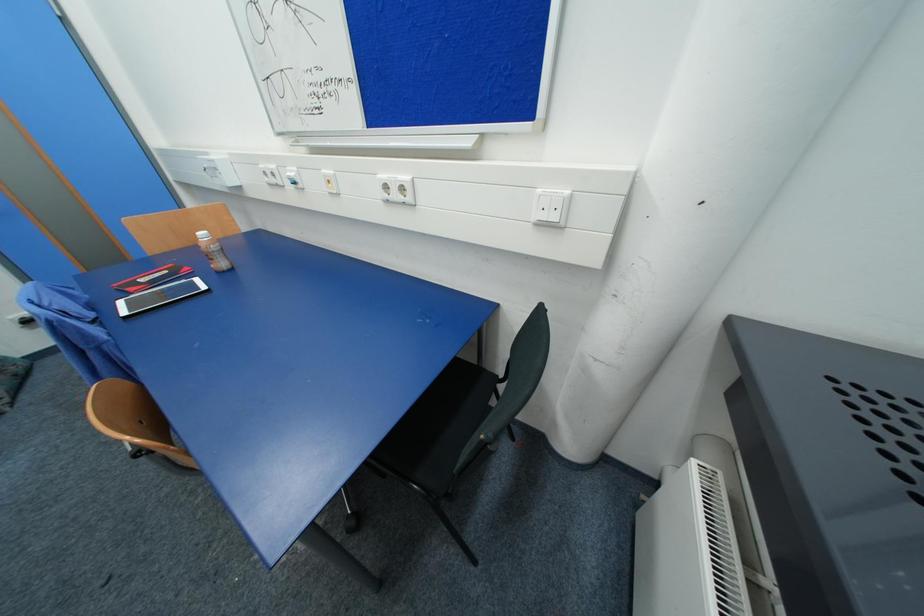
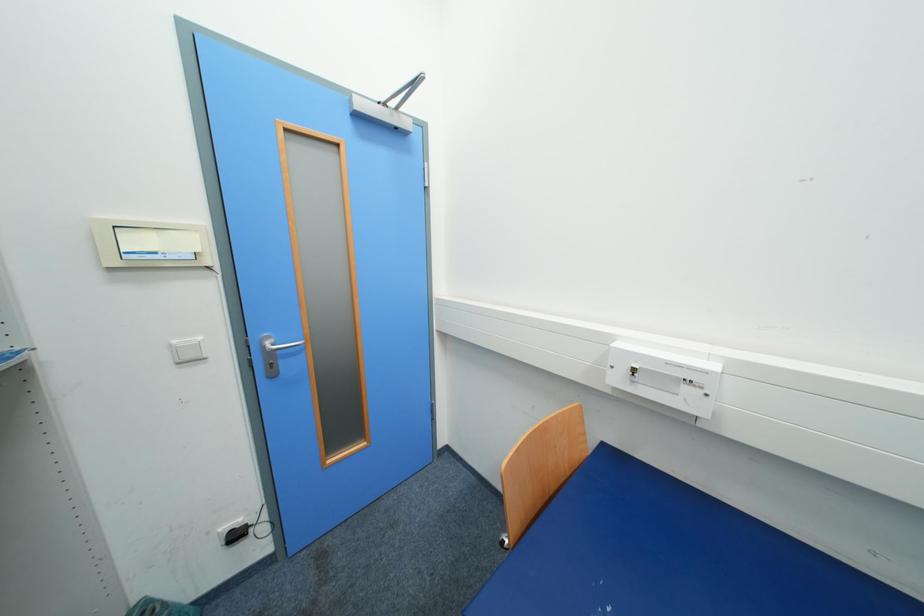
Question: The images are taken continuously from a first-person perspective. In which direction are you moving?

Choices:
 (A) Left
 (B) Right
 (C) Forward
 (D) Backward

Answer: (A)